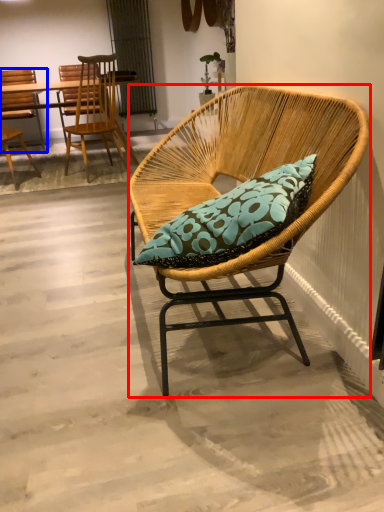
Question: Which object appears farthest to the camera in this image, chair (highlighted by a red box) or chair (highlighted by a blue box)?

Choices:
 (A) chair
 (B) chair

Answer: (B)